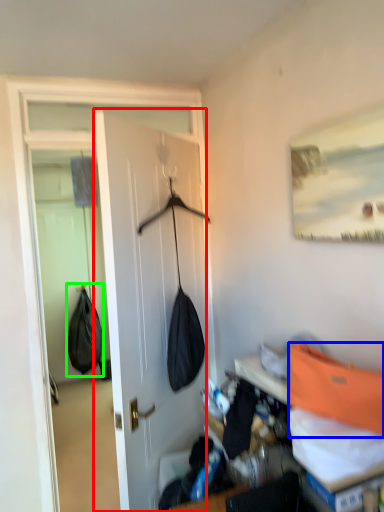
Question: Estimate the real-world distances between objects in this image. Which object is closer to door (highlighted by a red box), shoulder bag (highlighted by a blue box) or shoulder bag (highlighted by a green box)?

Choices:
 (A) shoulder bag
 (B) shoulder bag

Answer: (A)